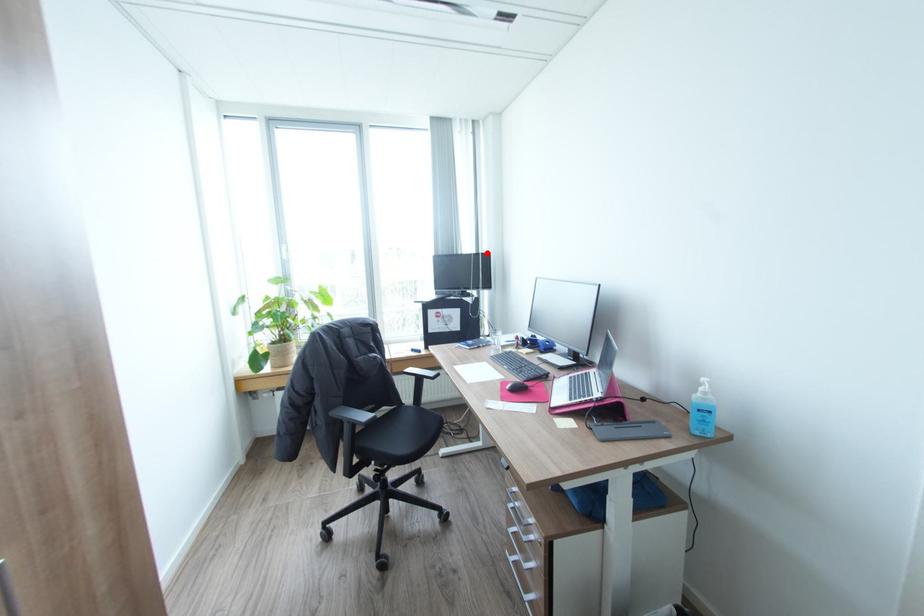
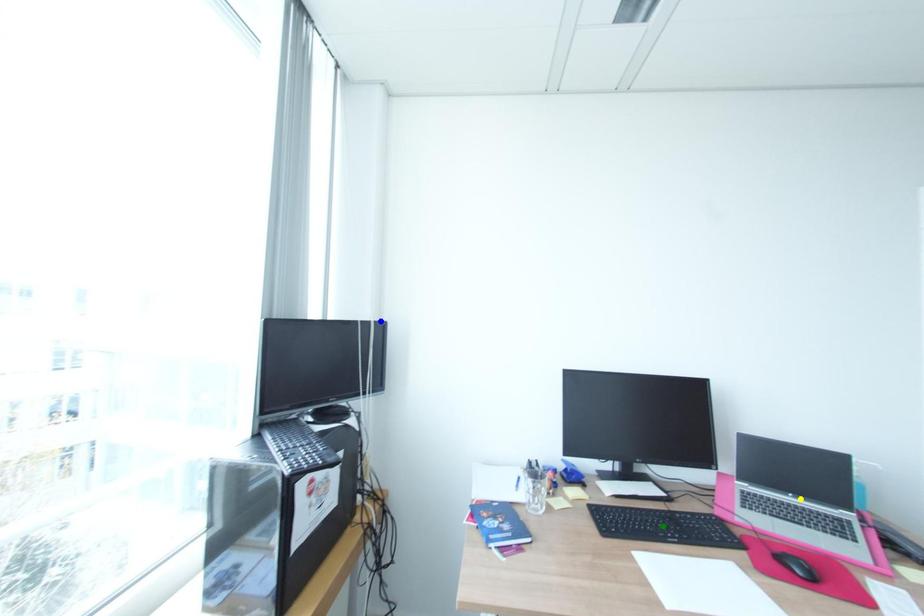
Question: I am providing you with two images of the same scene from different viewpoints. A red point is marked on the first image. You are given multiple points on the second image. Which point in image 2 is actually the same real-world point as the red point in image 1?

Choices:
 (A) yellow point
 (B) blue point
 (C) green point

Answer: (B)